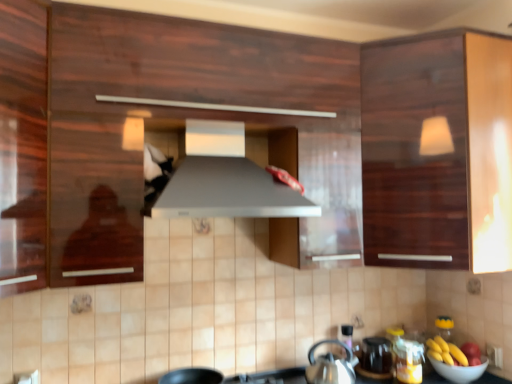
Question: Is satin silver exhaust hood at center situated inside yellow matte bananas at lower right or outside?

Choices:
 (A) outside
 (B) inside

Answer: (A)

Question: Considering the positions of satin silver exhaust hood at center and yellow matte bananas at lower right in the image, is satin silver exhaust hood at center taller or shorter than yellow matte bananas at lower right?

Choices:
 (A) tall
 (B) short

Answer: (A)

Question: Which object is positioned closest to the satin silver exhaust hood at center?

Choices:
 (A) silver metallic kettle at lower center
 (B) matte black kettle at lower center
 (C) white glossy bowl at lower right
 (D) yellow matte bananas at lower right
 (E) glossy wood cabinet at upper right

Answer: (E)

Question: Which is nearer to the satin silver exhaust hood at center?

Choices:
 (A) glossy wood cabinet at upper right
 (B) yellow matte bananas at lower right
 (C) white glossy bowl at lower right
 (D) matte black kettle at lower center
 (E) silver metallic kettle at lower center

Answer: (A)